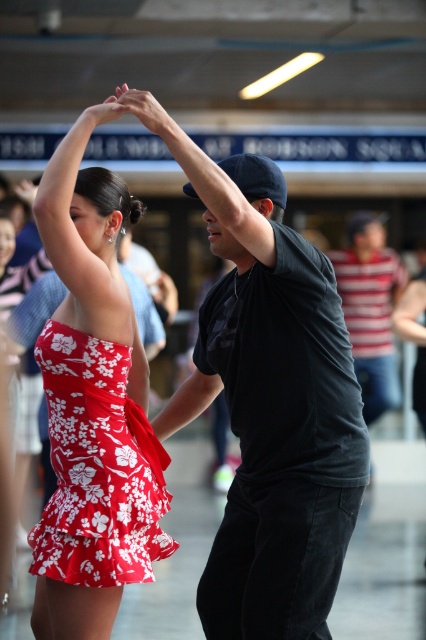
Question: Does black cotton t-shirt at center have a smaller size compared to red floral fabric dress at center?

Choices:
 (A) no
 (B) yes

Answer: (A)

Question: Which object is the closest to the black cotton t-shirt at center?

Choices:
 (A) red floral fabric dress at center
 (B) matte floral dress at center
 (C) striped cotton shirt at right

Answer: (B)

Question: Which object appears closest to the camera in this image?

Choices:
 (A) red floral fabric dress at center
 (B) matte floral dress at center
 (C) striped cotton shirt at right

Answer: (B)

Question: Which point is farther from the camera taking this photo?

Choices:
 (A) (354, 250)
 (B) (316, 387)
 (C) (88, 534)
 (D) (141, 538)

Answer: (A)

Question: In this image, where is black cotton t-shirt at center located relative to matte floral dress at center?

Choices:
 (A) right
 (B) left

Answer: (A)

Question: Is matte floral dress at center below striped cotton shirt at right?

Choices:
 (A) no
 (B) yes

Answer: (B)